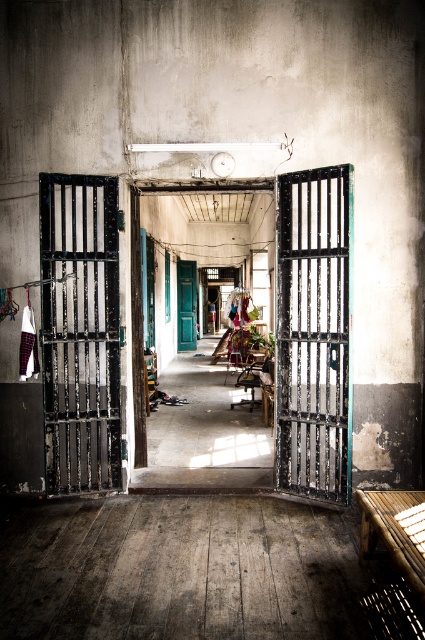
Is point (101, 426) in front of point (187, 291)?

Yes, point (101, 426) is in front of point (187, 291).

Between point (104, 433) and point (183, 266), which one is positioned behind?

Positioned behind is point (183, 266).

This screenshot has width=425, height=640. Identify the location of black metal bars at center. (79, 332).

Does black metal bars at center appear under black metal gate at center?

Incorrect, black metal bars at center is not positioned below black metal gate at center.

Can you confirm if black metal bars at center is thinner than black metal gate at center?

No, black metal bars at center is not thinner than black metal gate at center.

Measure the distance between black metal bars at center and camera.

A distance of 14.49 feet exists between black metal bars at center and camera.

At what (x,y) coordinates should I click in order to perform the action: click on black metal bars at center. Please return your answer as a coordinate pair (x, y). Image resolution: width=425 pixels, height=640 pixels. Looking at the image, I should click on (79, 332).

Find the location of a particular element. black metal gate at center is located at coordinates (314, 332).

Identify the location of black metal gate at center. The width and height of the screenshot is (425, 640). (314, 332).